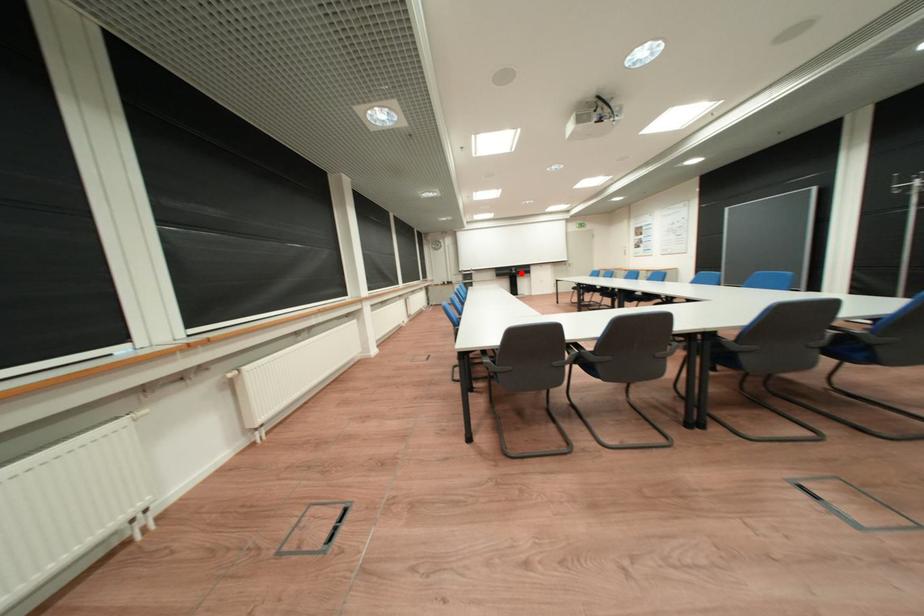
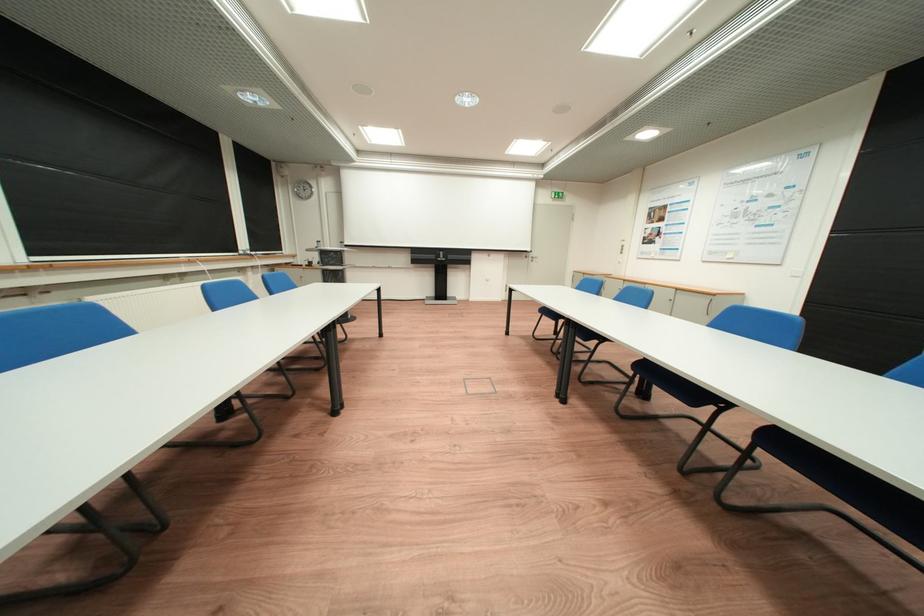
Find the pixel in the second image that matches the highlighted location in the first image.

(445, 257)